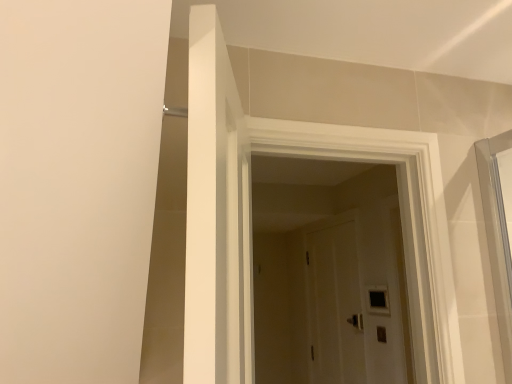
Question: From their relative heights in the image, would you say black glass window at center is taller or shorter than white wooden door at center?

Choices:
 (A) tall
 (B) short

Answer: (B)

Question: From a real-world perspective, relative to white wooden door at center, is black glass window at center vertically above or below?

Choices:
 (A) above
 (B) below

Answer: (B)

Question: From the image's perspective, is black glass window at center located above or below white wooden door at center?

Choices:
 (A) above
 (B) below

Answer: (B)

Question: Based on their sizes in the image, would you say white wooden door at center is bigger or smaller than black glass window at center?

Choices:
 (A) small
 (B) big

Answer: (B)

Question: From a real-world perspective, is white wooden door at center physically located above or below black glass window at center?

Choices:
 (A) above
 (B) below

Answer: (A)

Question: Is white wooden door at center inside or outside of black glass window at center?

Choices:
 (A) inside
 (B) outside

Answer: (B)

Question: Does point (422, 182) appear closer or farther from the camera than point (372, 301)?

Choices:
 (A) closer
 (B) farther

Answer: (A)